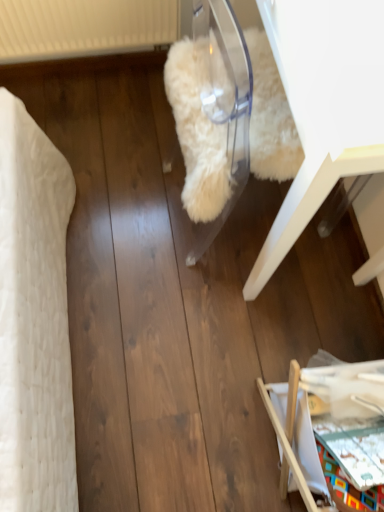
The width and height of the screenshot is (384, 512). I want to click on vacant space to the left of white fluffy rug at center, placed as the second furniture when sorted from bottom to top, so click(x=119, y=181).